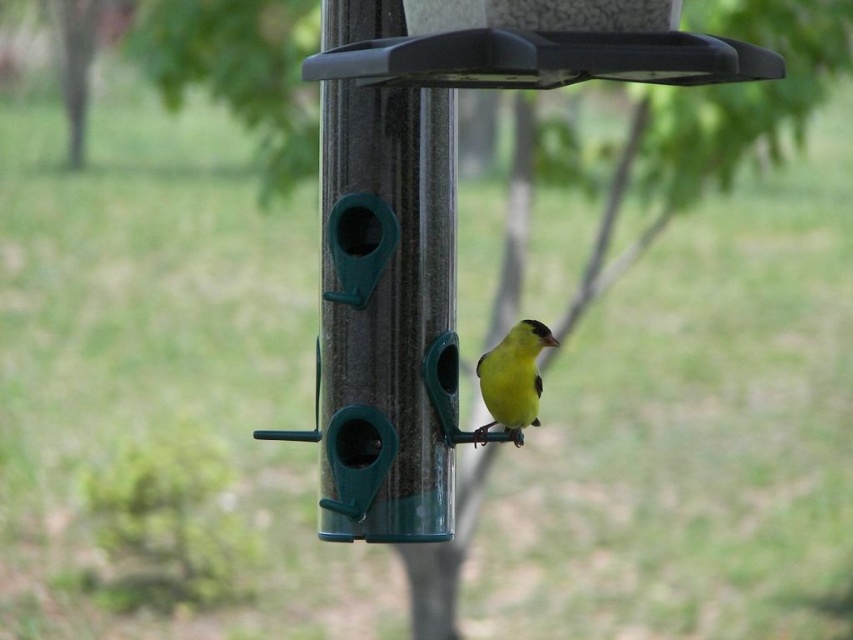
You are a birdwatcher trying to determine the relative sizes of objects in the scene. Which object is wider, the transparent plastic pole at center or the yellow matte bird at center?

The transparent plastic pole at center is wider than the yellow matte bird at center, as stated in the description.

You are a birdwatcher trying to capture a clear photo of the yellow matte bird at center. Since the transparent plastic pole at center is in the way, can you move the pole to get a better shot?

The transparent plastic pole at center has a larger size compared to yellow matte bird at center, so moving the pole might be difficult due to its size, making it hard to maneuver around the bird without disturbing it.

You are a photographer trying to capture a closeup of the bird feeder. You notice two points in the scene marked as point 1 at coordinates point (329,212) and point 2 at coordinates point (521,420). Which point should you focus on to get the sharpest image of the bird feeder?

Point 1 at coordinates point (329,212) is closer to the camera than point 2 at coordinates point (521,420), so focusing on point 1 will result in a sharper image of the bird feeder.